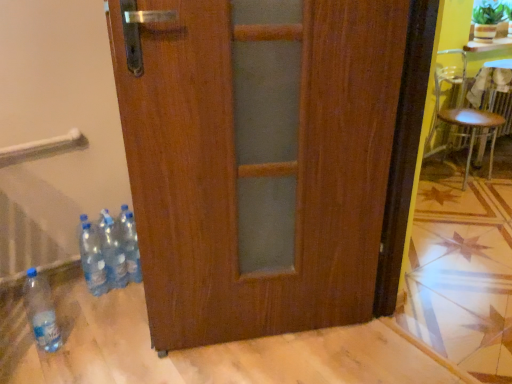
The height and width of the screenshot is (384, 512). What do you see at coordinates (92, 258) in the screenshot? I see `transparent plastic bottles at lower left, the 2th bottle positioned from the left` at bounding box center [92, 258].

How much space does translucent plastic bottles at lower left, the second bottle when ordered from right to left, occupy vertically?

The height of translucent plastic bottles at lower left, the second bottle when ordered from right to left, is 34.69 centimeters.

What is the approximate width of transparent plastic bottle at lower left, which is the 1th bottle from left to right?

The width of transparent plastic bottle at lower left, which is the 1th bottle from left to right, is 3.44 inches.

Image resolution: width=512 pixels, height=384 pixels. Describe the element at coordinates (489, 20) in the screenshot. I see `green leafy plant at upper right` at that location.

This screenshot has height=384, width=512. Identify the location of blue plastic bottle at lower left, which is the 4th bottle from left to right. (130, 245).

The height and width of the screenshot is (384, 512). What are the coordinates of `transparent plastic bottles at lower left, the 2th bottle positioned from the left` in the screenshot? It's located at click(x=92, y=258).

Between metallic silver chair at right and green leafy plant at upper right, which one has larger width?

metallic silver chair at right.

Considering the relative sizes of metallic silver chair at right and green leafy plant at upper right in the image provided, is metallic silver chair at right bigger than green leafy plant at upper right?

Indeed, metallic silver chair at right has a larger size compared to green leafy plant at upper right.

Looking at this image, from a real-world perspective, does metallic silver chair at right sit lower than green leafy plant at upper right?

Yes, from a real-world perspective, metallic silver chair at right is beneath green leafy plant at upper right.

How far apart are metallic silver chair at right and green leafy plant at upper right?

22.98 inches.

Considering the sizes of objects green leafy plant at upper right and transparent plastic bottle at lower left, positioned as the fourth bottle in right-to-left order, in the image provided, who is bigger, green leafy plant at upper right or transparent plastic bottle at lower left, positioned as the fourth bottle in right-to-left order,?

green leafy plant at upper right is bigger.

Which is closer to the camera, (487, 8) or (25, 297)?

Point (487, 8) is positioned farther from the camera compared to point (25, 297).

Is transparent plastic bottle at lower left, positioned as the fourth bottle in right-to-left order, inside green leafy plant at upper right?

That's incorrect, transparent plastic bottle at lower left, positioned as the fourth bottle in right-to-left order, is not inside green leafy plant at upper right.

From the picture: How many degrees apart are the facing directions of green leafy plant at upper right and transparent plastic bottle at lower left, positioned as the fourth bottle in right-to-left order?

The angular difference between green leafy plant at upper right and transparent plastic bottle at lower left, positioned as the fourth bottle in right-to-left order, is 5.24 degrees.

Is green leafy plant at upper right facing towards blue plastic bottle at lower left, placed as the 1th bottle when sorted from right to left?

No, green leafy plant at upper right is not facing towards blue plastic bottle at lower left, placed as the 1th bottle when sorted from right to left.

Based on the photo, from the image's perspective, relative to blue plastic bottle at lower left, placed as the 1th bottle when sorted from right to left, is green leafy plant at upper right above or below?

Based on their image positions, green leafy plant at upper right is located above blue plastic bottle at lower left, placed as the 1th bottle when sorted from right to left.

Is green leafy plant at upper right taller than blue plastic bottle at lower left, which is the 4th bottle from left to right?

Incorrect, the height of green leafy plant at upper right is not larger of that of blue plastic bottle at lower left, which is the 4th bottle from left to right.

Considering the positions of point (477, 23) and point (129, 272), is point (477, 23) closer or farther from the camera than point (129, 272)?

Clearly, point (477, 23) is more distant from the camera than point (129, 272).

Between green leafy plant at upper right and translucent plastic bottles at lower left, the second bottle when ordered from right to left, which one has larger width?

green leafy plant at upper right.

Based on the photo, does green leafy plant at upper right have a larger size compared to translucent plastic bottles at lower left, the second bottle when ordered from right to left?

Yes, green leafy plant at upper right is bigger than translucent plastic bottles at lower left, the second bottle when ordered from right to left.

From a real-world perspective, is green leafy plant at upper right positioned above or below translucent plastic bottles at lower left, the third bottle in the left-to-right sequence?

From a real-world perspective, green leafy plant at upper right is physically above translucent plastic bottles at lower left, the third bottle in the left-to-right sequence.

I want to click on houseplant on the right of translucent plastic bottles at lower left, the second bottle when ordered from right to left, so click(x=489, y=20).

Which is less distant, [103,292] or [127,266]?

The point [103,292] is closer to the camera.

From a real-world perspective, which is physically below, transparent plastic bottles at lower left, the 2th bottle positioned from the left, or blue plastic bottle at lower left, placed as the 1th bottle when sorted from right to left?

transparent plastic bottles at lower left, the 2th bottle positioned from the left, is physically lower.

Locate an element on the screen. The image size is (512, 384). the 2nd bottle to the left when counting from the blue plastic bottle at lower left, placed as the 1th bottle when sorted from right to left is located at coordinates (92, 258).

Which object is more forward, metallic silver chair at right or transparent plastic bottles at lower left, marked as the third bottle in a right-to-left arrangement?

transparent plastic bottles at lower left, marked as the third bottle in a right-to-left arrangement, is in front.

Consider the image. Is transparent plastic bottles at lower left, the 2th bottle positioned from the left, surrounded by metallic silver chair at right?

No, transparent plastic bottles at lower left, the 2th bottle positioned from the left, is not a part of metallic silver chair at right.

Considering the points (440, 117) and (95, 290), which point is in front, point (440, 117) or point (95, 290)?

The point (95, 290) is closer.

In the scene shown: From a real-world perspective, who is located lower, metallic silver chair at right or transparent plastic bottles at lower left, the 2th bottle positioned from the left?

From a 3D spatial view, transparent plastic bottles at lower left, the 2th bottle positioned from the left, is below.

In the image, is transparent plastic bottle at lower left, which is the 1th bottle from left to right, positioned in front of or behind transparent plastic bottles at lower left, the 2th bottle positioned from the left?

Clearly, transparent plastic bottle at lower left, which is the 1th bottle from left to right, is in front of transparent plastic bottles at lower left, the 2th bottle positioned from the left.

Looking at the image, does transparent plastic bottle at lower left, which is the 1th bottle from left to right, seem bigger or smaller compared to transparent plastic bottles at lower left, the 2th bottle positioned from the left?

Considering their sizes, transparent plastic bottle at lower left, which is the 1th bottle from left to right, takes up more space than transparent plastic bottles at lower left, the 2th bottle positioned from the left.

Is transparent plastic bottle at lower left, positioned as the fourth bottle in right-to-left order, positioned with its back to transparent plastic bottles at lower left, marked as the third bottle in a right-to-left arrangement?

No.

Is point (37, 307) more distant than point (88, 243)?

No, it is not.

What are the coordinates of `chair below the green leafy plant at upper right (from the image's perspective)` in the screenshot? It's located at (471, 125).

I want to click on houseplant above the transparent plastic bottle at lower left, positioned as the fourth bottle in right-to-left order (from the image's perspective), so click(x=489, y=20).

Looking at this image, considering their positions, is transparent plastic bottles at lower left, marked as the third bottle in a right-to-left arrangement, positioned closer to green leafy plant at upper right than metallic silver chair at right?

metallic silver chair at right is closer to green leafy plant at upper right.

Estimate the real-world distances between objects in this image. Which object is closer to green leafy plant at upper right, metallic silver chair at right or blue plastic bottle at lower left, placed as the 1th bottle when sorted from right to left?

metallic silver chair at right.

Which object lies further to the anchor point transparent plastic bottles at lower left, marked as the third bottle in a right-to-left arrangement, metallic silver chair at right or blue plastic bottle at lower left, placed as the 1th bottle when sorted from right to left?

metallic silver chair at right is positioned further to the anchor transparent plastic bottles at lower left, marked as the third bottle in a right-to-left arrangement.

Which object lies nearer to the anchor point green leafy plant at upper right, translucent plastic bottles at lower left, the second bottle when ordered from right to left, or transparent plastic bottle at lower left, which is the 1th bottle from left to right?

translucent plastic bottles at lower left, the second bottle when ordered from right to left, is closer to green leafy plant at upper right.

Consider the image. Which object lies nearer to the anchor point green leafy plant at upper right, metallic silver chair at right or transparent plastic bottles at lower left, the 2th bottle positioned from the left?

metallic silver chair at right is positioned closer to the anchor green leafy plant at upper right.

Which object lies further to the anchor point green leafy plant at upper right, transparent plastic bottles at lower left, the 2th bottle positioned from the left, or transparent plastic bottle at lower left, which is the 1th bottle from left to right?

transparent plastic bottle at lower left, which is the 1th bottle from left to right, lies further to green leafy plant at upper right than the other object.

Which object lies further to the anchor point transparent plastic bottle at lower left, positioned as the fourth bottle in right-to-left order, translucent plastic bottles at lower left, the third bottle in the left-to-right sequence, or green leafy plant at upper right?

Among the two, green leafy plant at upper right is located further to transparent plastic bottle at lower left, positioned as the fourth bottle in right-to-left order.

When comparing their distances from metallic silver chair at right, does transparent plastic bottles at lower left, the 2th bottle positioned from the left, or blue plastic bottle at lower left, placed as the 1th bottle when sorted from right to left, seem further?

The object further to metallic silver chair at right is transparent plastic bottles at lower left, the 2th bottle positioned from the left.

Where is `bottle between translucent plastic bottles at lower left, the third bottle in the left-to-right sequence, and metallic silver chair at right`? bottle between translucent plastic bottles at lower left, the third bottle in the left-to-right sequence, and metallic silver chair at right is located at coordinates (130, 245).

At what (x,y) coordinates should I click in order to perform the action: click on houseplant between translucent plastic bottles at lower left, the third bottle in the left-to-right sequence, and metallic silver chair at right. Please return your answer as a coordinate pair (x, y). This screenshot has height=384, width=512. Looking at the image, I should click on (489, 20).

The image size is (512, 384). I want to click on bottle between transparent plastic bottle at lower left, which is the 1th bottle from left to right, and translucent plastic bottles at lower left, the third bottle in the left-to-right sequence, from front to back, so click(x=92, y=258).

Find the location of a particular element. Image resolution: width=512 pixels, height=384 pixels. bottle between transparent plastic bottles at lower left, the 2th bottle positioned from the left, and blue plastic bottle at lower left, placed as the 1th bottle when sorted from right to left, from left to right is located at coordinates (113, 255).